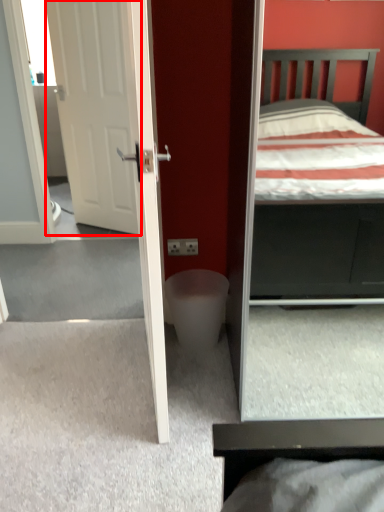
Question: In this image, where is door (annotated by the red box) located relative to toilet bowl?

Choices:
 (A) right
 (B) left

Answer: (B)